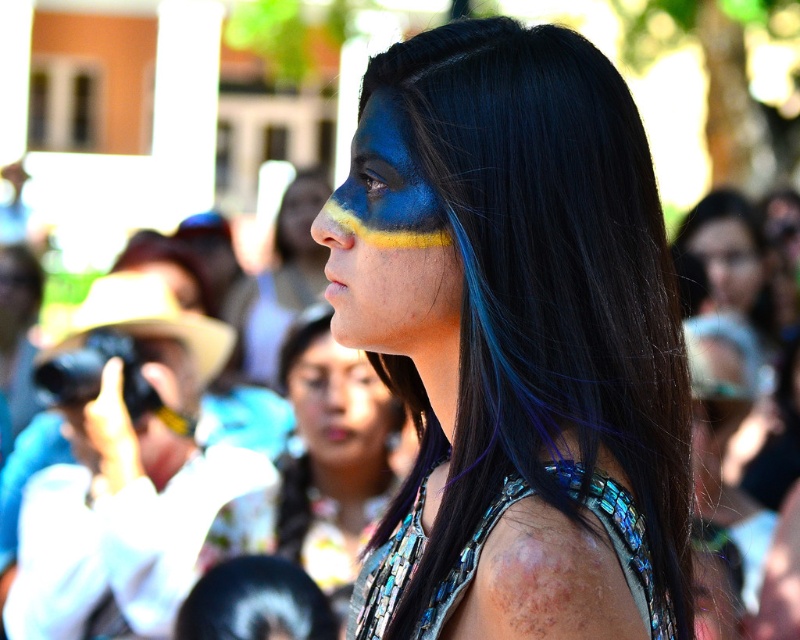
Can you confirm if matte blue face at center is smaller than matte blue face paint at center?

No.

Can you confirm if matte blue face at center is positioned above matte blue face paint at center?

No.

Does point (354, 362) lie in front of point (716, 288)?

Yes, point (354, 362) is in front of point (716, 288).

The width and height of the screenshot is (800, 640). What are the coordinates of `matte blue face at center` in the screenshot? It's located at click(x=340, y=406).

Is blue matte face paint at center smaller than matte blue face paint at center?

No.

Which is in front, point (346, 388) or point (724, 300)?

Point (346, 388) is in front.

Who is more forward, (312, 461) or (742, 227)?

Point (312, 461) is more forward.

Where is `blue matte face paint at center`? The height and width of the screenshot is (640, 800). blue matte face paint at center is located at coordinates (333, 451).

Who is more distant from viewer, (x=297, y=388) or (x=310, y=180)?

The point (x=310, y=180) is behind.

Is matte blue face at center positioned before blue matte paint at nose?

Yes, matte blue face at center is closer to the viewer.

Between point (378, 394) and point (302, 216), which one is positioned in front?

Point (378, 394) is in front.

Identify the location of matte blue face at center. The width and height of the screenshot is (800, 640). (340, 406).